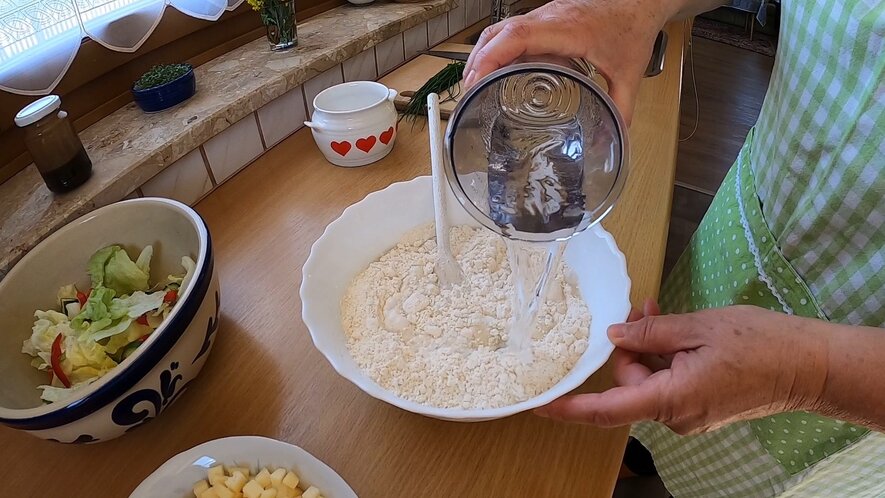
The height and width of the screenshot is (498, 885). Identify the location of wooden spoon. (433, 127).